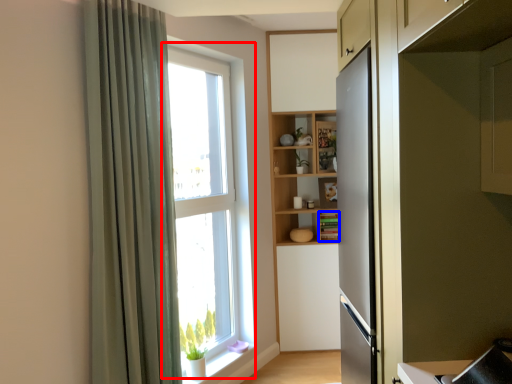
Question: Which object is closer to the camera taking this photo, window (highlighted by a red box) or cabinet (highlighted by a blue box)?

Choices:
 (A) window
 (B) cabinet

Answer: (A)